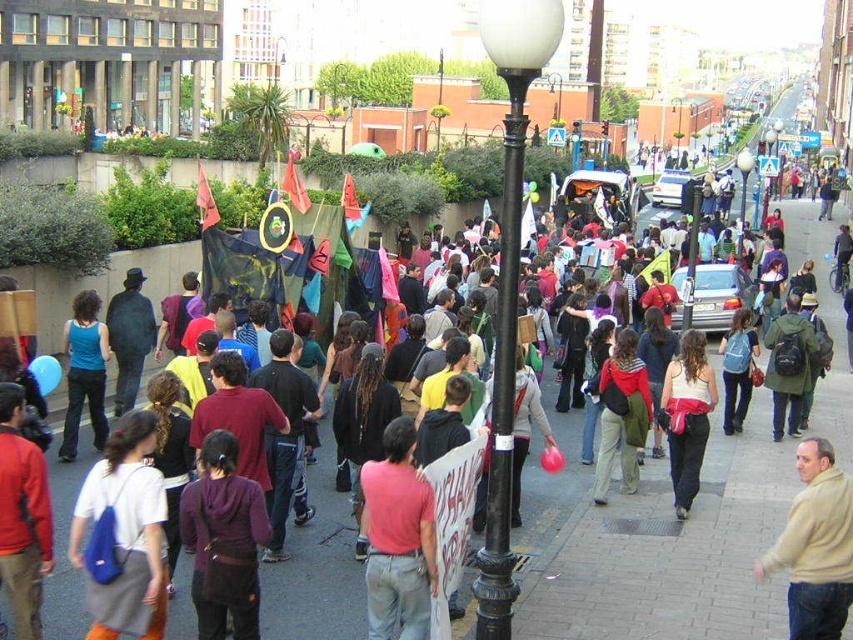
You are standing on the sidewalk in the street scene and want to find the beige sweater at lower right. What is the location of the point at coordinates [815,545] relative to the beige sweater at lower right?

The point at coordinates [815,545] is located on the beige sweater at lower right.

You are standing at the edge of the street in the lively scene. You see a blue fabric backpack at lower left. Can you reach it without moving from your current position?

The blue fabric backpack at lower left is 16.04 meters away from you, so you cannot reach it without moving from your current position.